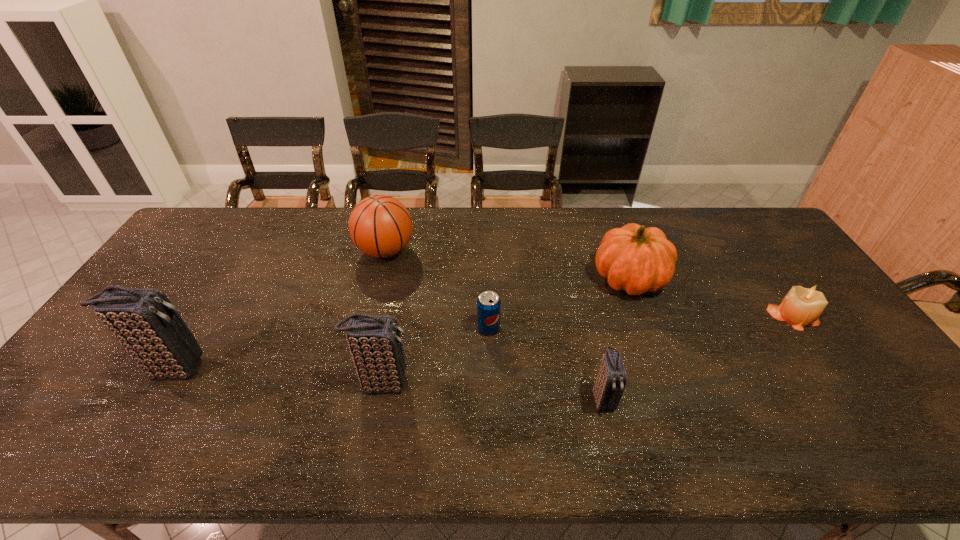
Find the location of a particular element. The width and height of the screenshot is (960, 540). vacant area that lies between the pumpkin and the leftmost object is located at coordinates (401, 323).

Identify the location of vacant space that's between the leftmost clutch bag and the fourth object from left to right. The height and width of the screenshot is (540, 960). (331, 348).

In order to click on vacant space in between the pop soda and the fifth object from left to right in this screenshot , I will do `click(545, 363)`.

The width and height of the screenshot is (960, 540). I want to click on vacant region between the fourth object from left to right and the shortest clutch bag, so click(x=545, y=363).

Image resolution: width=960 pixels, height=540 pixels. I want to click on vacant space that is in between the pumpkin and the third shortest object, so click(616, 338).

At what (x,y) coordinates should I click in order to perform the action: click on unoccupied area between the rightmost clutch bag and the pop soda. Please return your answer as a coordinate pair (x, y). This screenshot has width=960, height=540. Looking at the image, I should click on (545, 363).

The image size is (960, 540). What are the coordinates of `free space between the rightmost object and the second shortest clutch bag` in the screenshot? It's located at (588, 349).

Where is `empty space that is in between the fifth object from left to right and the candle`? This screenshot has height=540, width=960. empty space that is in between the fifth object from left to right and the candle is located at coordinates (698, 357).

Where is `vacant space in between the fourth object from left to right and the second tallest clutch bag`? The image size is (960, 540). vacant space in between the fourth object from left to right and the second tallest clutch bag is located at coordinates (435, 355).

The height and width of the screenshot is (540, 960). I want to click on blank region between the second tallest clutch bag and the fourth object from left to right, so click(435, 355).